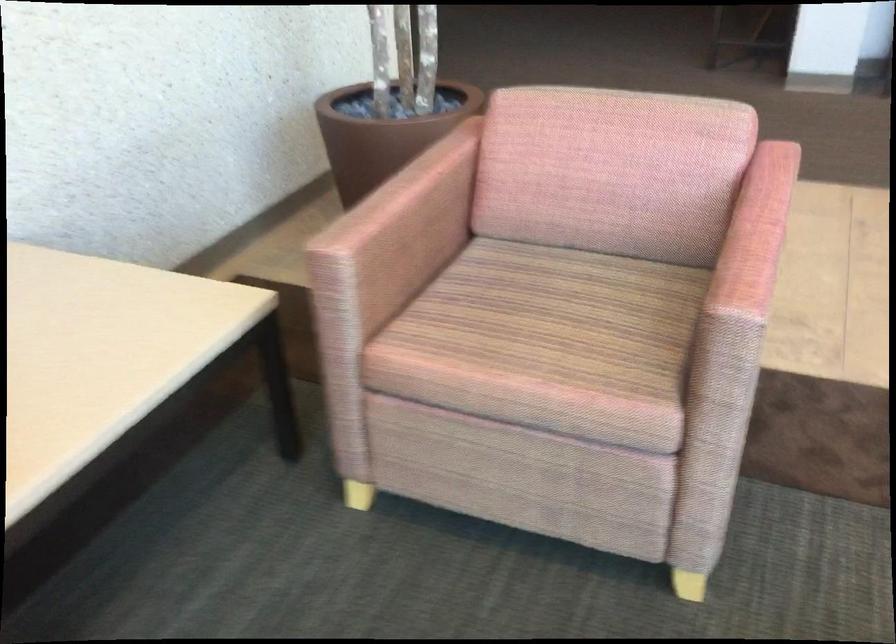
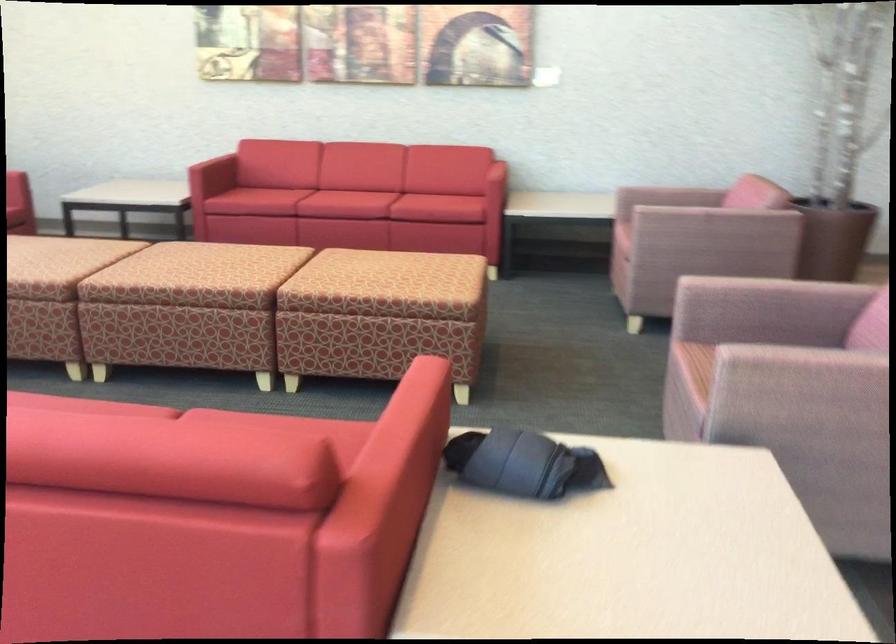
The point at (485,370) is marked in the first image. Where is the corresponding point in the second image?

(624, 218)